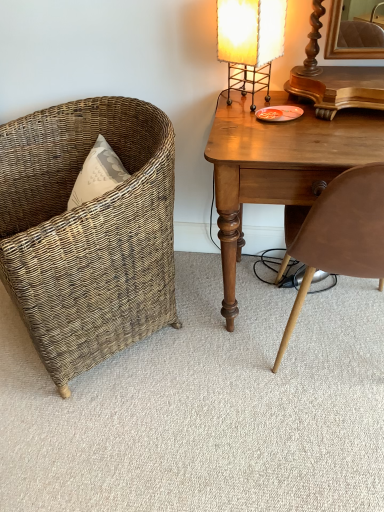
The image size is (384, 512). I want to click on vacant space in front of wooden desk at right, so click(276, 429).